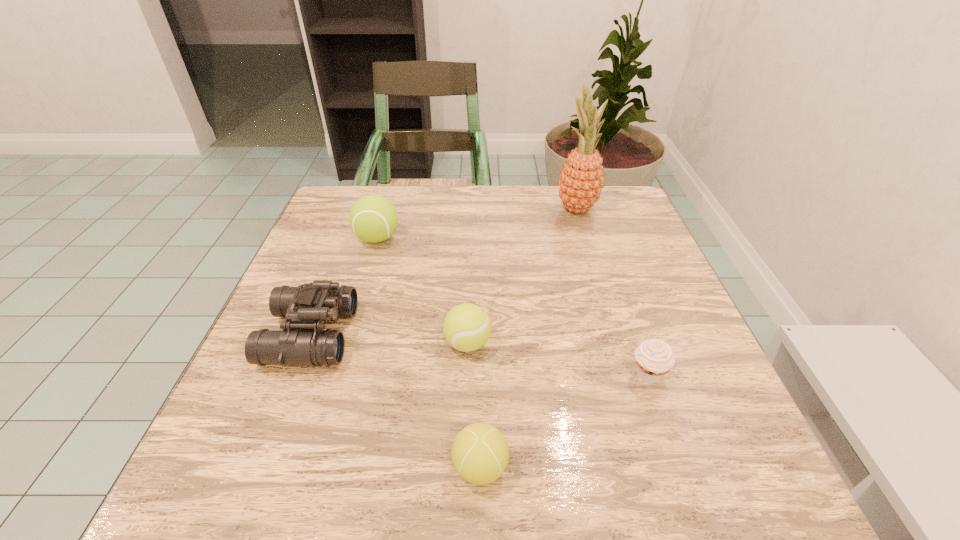
Where is `muffin located in the right edge section of the desktop`? muffin located in the right edge section of the desktop is located at coordinates (654, 357).

You are a GUI agent. You are given a task and a screenshot of the screen. Output one action in this format:
    pyautogui.click(x=<x>, y=<y>)
    Task: Click on the object at the far left corner
    The image size is (960, 540).
    Given the screenshot: What is the action you would take?
    pyautogui.click(x=373, y=218)

I want to click on object that is positioned at the far right corner, so click(581, 180).

In the image, there is a desktop. At what (x,y) coordinates should I click in order to perform the action: click on vacant space at the far edge. Please return your answer as a coordinate pair (x, y). The width and height of the screenshot is (960, 540). Looking at the image, I should click on (476, 211).

Find the location of a particular element. free space at the near edge of the desktop is located at coordinates (342, 507).

In the image, there is a desktop. Where is `vacant space at the left edge`? The width and height of the screenshot is (960, 540). vacant space at the left edge is located at coordinates (301, 258).

The image size is (960, 540). Identify the location of free region at the right edge of the desktop. click(633, 373).

Image resolution: width=960 pixels, height=540 pixels. Find the location of `vacant space at the far left corner of the desktop`. vacant space at the far left corner of the desktop is located at coordinates (333, 221).

What are the coordinates of `vacant space at the near left corner of the desktop` in the screenshot? It's located at (250, 448).

The width and height of the screenshot is (960, 540). Identify the location of vacant space at the near right corner of the desktop. (673, 504).